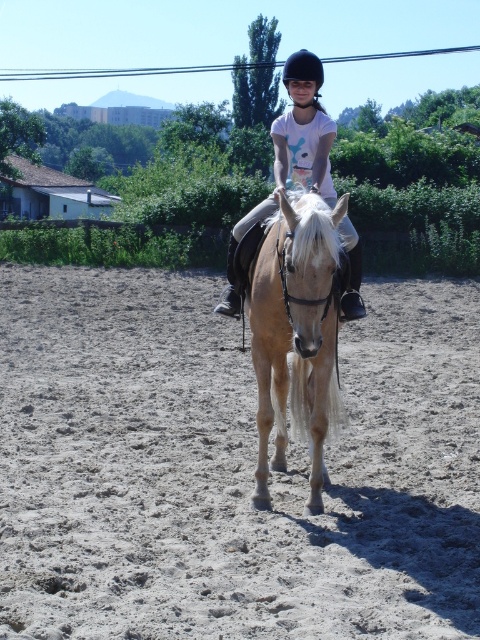
Question: Does white matte shirt at center appear on the left side of black hard helmet at center?

Choices:
 (A) yes
 (B) no

Answer: (A)

Question: Estimate the real-world distances between objects in this image. Which object is closer to the light brown glossy horse at center?

Choices:
 (A) light brown sandy ground at center
 (B) white matte shirt at center
 (C) black hard helmet at center

Answer: (B)

Question: Which of the following is the closest to the observer?

Choices:
 (A) black hard helmet at center
 (B) light brown sandy ground at center
 (C) white matte shirt at center

Answer: (B)

Question: Which object appears closest to the camera in this image?

Choices:
 (A) light brown sandy ground at center
 (B) white matte shirt at center

Answer: (A)

Question: Is the position of light brown sandy ground at center more distant than that of black hard helmet at center?

Choices:
 (A) no
 (B) yes

Answer: (A)

Question: Considering the relative positions of light brown glossy horse at center and black hard helmet at center in the image provided, where is light brown glossy horse at center located with respect to black hard helmet at center?

Choices:
 (A) left
 (B) right

Answer: (A)